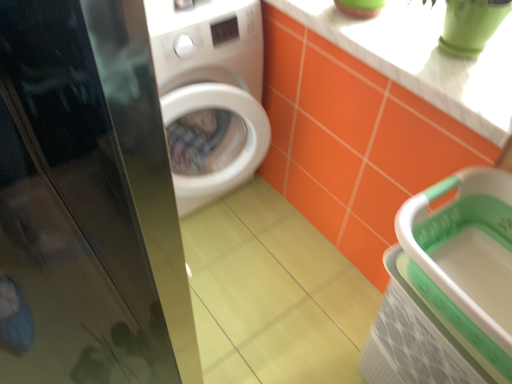
Question: Is green plastic basket at lower right surrounding glossy black screen door at left?

Choices:
 (A) no
 (B) yes

Answer: (A)

Question: Is green plastic basket at lower right oriented away from glossy black screen door at left?

Choices:
 (A) no
 (B) yes

Answer: (A)

Question: Considering the relative sizes of green plastic basket at lower right and glossy black screen door at left in the image provided, is green plastic basket at lower right taller than glossy black screen door at left?

Choices:
 (A) yes
 (B) no

Answer: (B)

Question: Does green plastic basket at lower right appear on the right side of glossy black screen door at left?

Choices:
 (A) yes
 (B) no

Answer: (A)

Question: Is green plastic basket at lower right bigger than glossy black screen door at left?

Choices:
 (A) no
 (B) yes

Answer: (B)

Question: From a real-world perspective, is green plastic basket at lower right on glossy black screen door at left?

Choices:
 (A) no
 (B) yes

Answer: (A)

Question: Would you consider white glossy counter top at upper right to be distant from glossy black screen door at left?

Choices:
 (A) no
 (B) yes

Answer: (A)

Question: From the image's perspective, is white glossy counter top at upper right below glossy black screen door at left?

Choices:
 (A) no
 (B) yes

Answer: (A)

Question: Does white glossy counter top at upper right appear on the right side of glossy black screen door at left?

Choices:
 (A) yes
 (B) no

Answer: (A)

Question: Considering the relative positions of white glossy counter top at upper right and glossy black screen door at left in the image provided, is white glossy counter top at upper right behind glossy black screen door at left?

Choices:
 (A) no
 (B) yes

Answer: (B)

Question: Considering the relative sizes of white glossy counter top at upper right and glossy black screen door at left in the image provided, is white glossy counter top at upper right thinner than glossy black screen door at left?

Choices:
 (A) no
 (B) yes

Answer: (A)

Question: Is glossy black screen door at left inside white glossy counter top at upper right?

Choices:
 (A) no
 (B) yes

Answer: (A)

Question: Is glossy black screen door at left taller than green plastic basket at lower right?

Choices:
 (A) no
 (B) yes

Answer: (B)